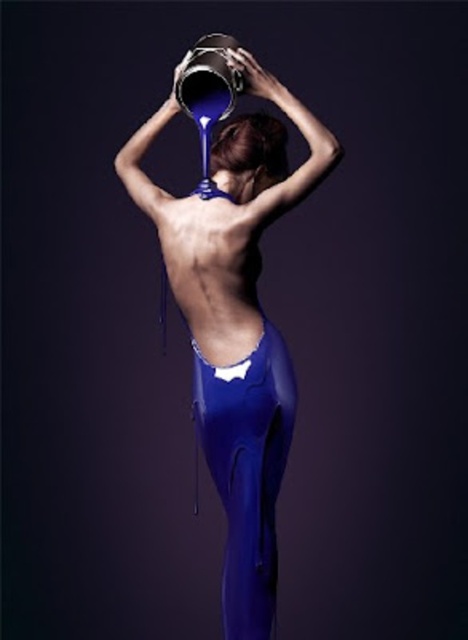
You are a photographer trying to capture the reflection of the shiny blue tight at lower center and the white matte bikini top at center. Which object will have a more prominent reflection in the metallic paint can?

The shiny blue tight at lower center will have a more prominent reflection in the metallic paint can because it is closer to the viewer than the white matte bikini top at center.

Based on the scene description, can you determine if the shiny blue tight at lower center is wider than the satin brown hair at upper center?

The shiny blue tight at lower center might be wider than the satin brown hair at upper center according to the description.

You are a photographer observing the scene. You notice the shiny blue tight at lower center and the satin brown hair at upper center. Which object is located closer to the bottom of the image?

The shiny blue tight at lower center is positioned under the satin brown hair at upper center, so it is closer to the bottom of the image.